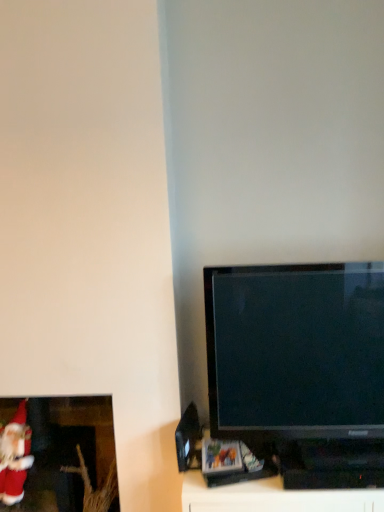
Question: Is black glossy tv at right at the left side of matte red santa at lower left?

Choices:
 (A) yes
 (B) no

Answer: (B)

Question: Does black glossy tv at right have a greater height compared to matte red santa at lower left?

Choices:
 (A) no
 (B) yes

Answer: (A)

Question: From a real-world perspective, is black glossy tv at right positioned under matte red santa at lower left based on gravity?

Choices:
 (A) no
 (B) yes

Answer: (A)

Question: From the image's perspective, is black glossy tv at right under matte red santa at lower left?

Choices:
 (A) yes
 (B) no

Answer: (B)

Question: Can you confirm if black glossy tv at right is wider than matte red santa at lower left?

Choices:
 (A) no
 (B) yes

Answer: (A)

Question: Can you confirm if black glossy tv at right is thinner than matte red santa at lower left?

Choices:
 (A) yes
 (B) no

Answer: (A)

Question: Considering the relative sizes of matte red santa at lower left and black glossy tv at right in the image provided, is matte red santa at lower left wider than black glossy tv at right?

Choices:
 (A) no
 (B) yes

Answer: (B)

Question: Could black glossy tv at right be considered to be inside matte red santa at lower left?

Choices:
 (A) yes
 (B) no

Answer: (B)

Question: Does matte red santa at lower left come in front of black glossy tv at right?

Choices:
 (A) no
 (B) yes

Answer: (A)

Question: Is matte red santa at lower left shorter than black glossy tv at right?

Choices:
 (A) yes
 (B) no

Answer: (B)

Question: Is matte red santa at lower left behind black glossy tv at right?

Choices:
 (A) yes
 (B) no

Answer: (A)

Question: Is matte red santa at lower left at the left side of black glossy tv at right?

Choices:
 (A) yes
 (B) no

Answer: (A)

Question: Does velvet red santa claus at lower left turn towards black glossy tv at right?

Choices:
 (A) yes
 (B) no

Answer: (B)